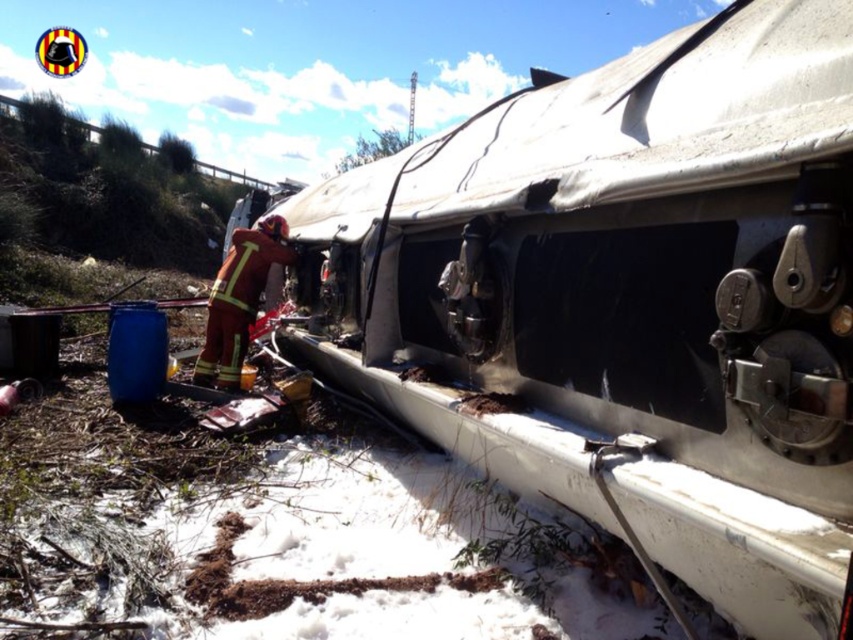
You are a rescue team member observing the scene. You need to determine if the silver metallic train car at center can be moved by a crane that can handle objects up to the size of the firefighter uniform at center. Can it be moved?

The silver metallic train car at center is bigger than firefighter uniform at center, so the crane cannot move it since it exceeds the size capacity.

You are a safety inspector evaluating the scene. The silver metallic train car at center and firefighter uniform at center are both visible. Which object is wider?

The silver metallic train car at center is wider than the firefighter uniform at center.